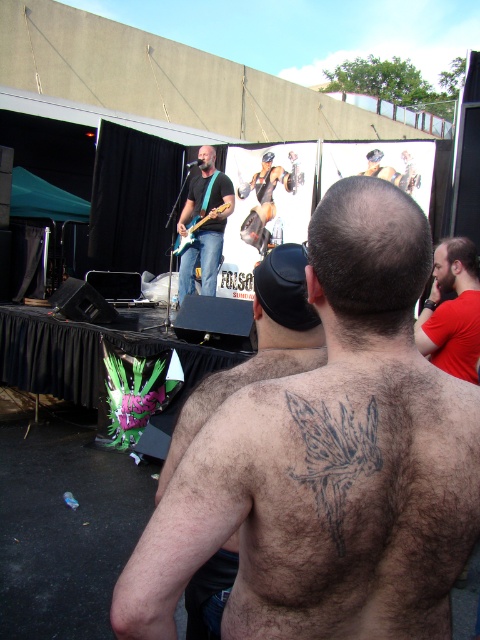
Question: Observing the image, what is the correct spatial positioning of hairy skin tattoo at back in reference to red matte shirt at upper right?

Choices:
 (A) right
 (B) left

Answer: (B)

Question: Among these points, which one is nearest to the camera?

Choices:
 (A) (205, 419)
 (B) (377, 172)
 (C) (331, 451)

Answer: (C)

Question: Which object appears farthest from the camera in this image?

Choices:
 (A) smooth black tank top at upper center
 (B) black ink tattoo at back
 (C) red matte shirt at upper right
 (D) hairy skin tattoo at center

Answer: (A)

Question: Where is hairy skin tattoo at back located in relation to smooth black tank top at upper center in the image?

Choices:
 (A) below
 (B) above

Answer: (A)

Question: Among these points, which one is farthest from the camera?

Choices:
 (A) (433, 282)
 (B) (256, 330)
 (C) (397, 180)

Answer: (C)

Question: In this image, where is hairy skin tattoo at center located relative to hairy skin tattoo at back?

Choices:
 (A) below
 (B) above

Answer: (B)